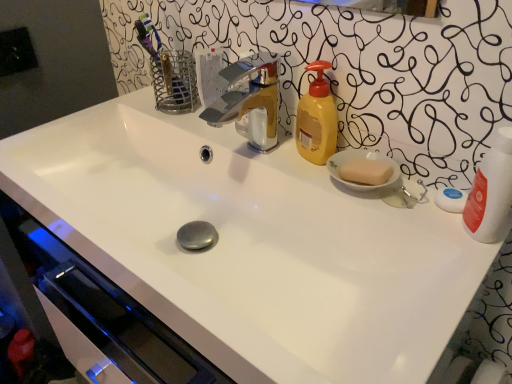
At what (x,y) coordinates should I click in order to perform the action: click on vacant region in front of yellow matte soap dispenser at upper right. Please return your answer as a coordinate pair (x, y). This screenshot has width=512, height=384. Looking at the image, I should click on (350, 194).